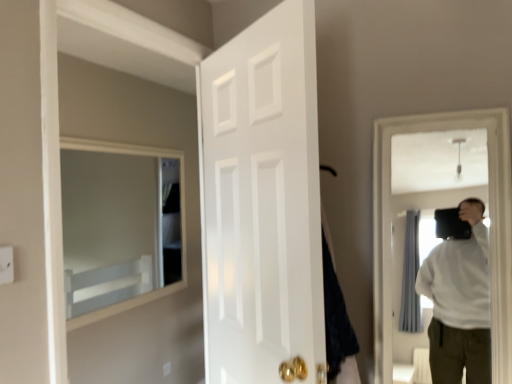
Measure the distance between white matte door at center and camera.

3.68 feet.

What do you see at coordinates (262, 203) in the screenshot? I see `white matte door at center` at bounding box center [262, 203].

Locate an element on the screen. The width and height of the screenshot is (512, 384). white matte door at center is located at coordinates (262, 203).

Find the location of a particular element. This screenshot has width=512, height=384. white matte door at center is located at coordinates (262, 203).